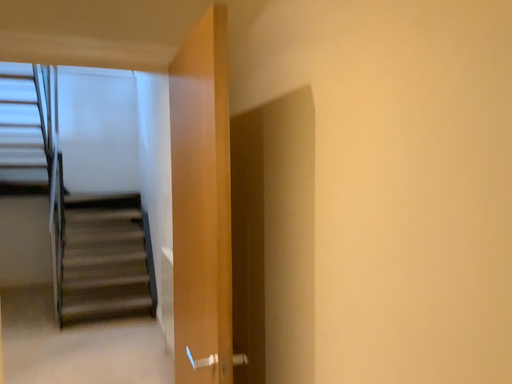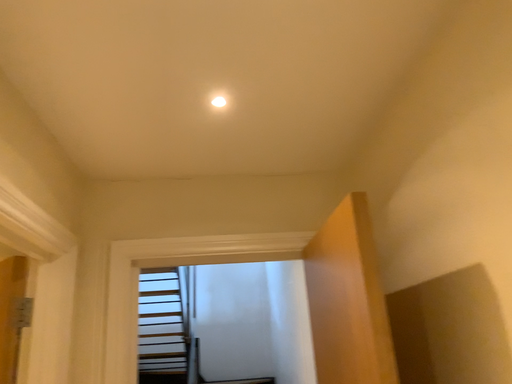
Question: Which way did the camera rotate in the video?

Choices:
 (A) rotated downward
 (B) rotated upward

Answer: (B)